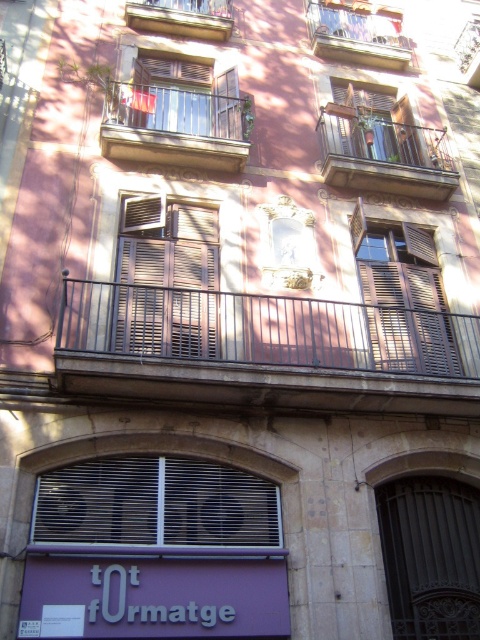
Is metallic silver balcony at upper center shorter than wooden brown balcony at upper center?

Incorrect, metallic silver balcony at upper center's height does not fall short of wooden brown balcony at upper center's.

Can you confirm if metallic silver balcony at upper center is thinner than wooden brown balcony at upper center?

Incorrect, metallic silver balcony at upper center's width is not less than wooden brown balcony at upper center's.

Identify the location of metallic silver balcony at upper center. The image size is (480, 640). (175, 128).

Does metallic black balcony at center lie behind metallic balcony at upper center?

No.

Who is positioned more to the left, metallic black balcony at center or metallic balcony at upper center?

metallic balcony at upper center is more to the left.

Is point (416, 154) closer to camera compared to point (315, 44)?

That is True.

Identify the location of metallic black balcony at center. This screenshot has height=640, width=480. 384,154.

Which is in front, point (192, 296) or point (339, 120)?

Point (192, 296) is in front.

Who is more forward, [446,323] or [351,109]?

Point [446,323] is in front.

This screenshot has width=480, height=640. What are the coordinates of `metallic gray balcony at center` in the screenshot? It's located at (264, 349).